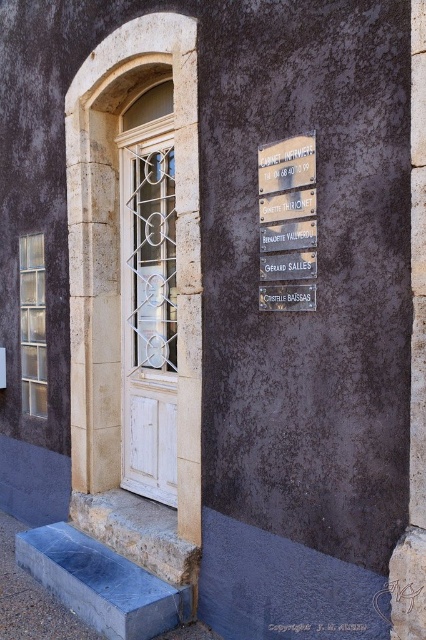
Does white wooden door at left lie in front of rustic wood sign at upper right?

No, it is behind rustic wood sign at upper right.

Which of these two, white wooden door at left or rustic wood sign at upper right, stands taller?

Standing taller between the two is white wooden door at left.

Does point (175, 387) lie behind point (313, 218)?

Yes, point (175, 387) is farther from viewer.

Find the location of `white wooden door at left`. white wooden door at left is located at coordinates (149, 317).